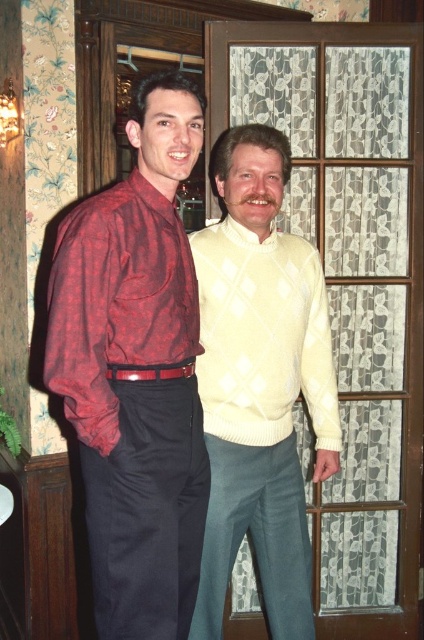
Question: Can you confirm if plaid shirt at left is thinner than matte red plaid shirt at left?

Choices:
 (A) no
 (B) yes

Answer: (A)

Question: Which of the following is the farthest from the observer?

Choices:
 (A) matte yellow sweater at center
 (B) plaid shirt at left

Answer: (A)

Question: Can you confirm if matte yellow sweater at center is smaller than matte red plaid shirt at left?

Choices:
 (A) yes
 (B) no

Answer: (B)

Question: Which of the following is the closest to the observer?

Choices:
 (A) cream knitted sweater at center
 (B) plaid shirt at left
 (C) matte red plaid shirt at left

Answer: (C)

Question: Which of the following is the farthest from the observer?

Choices:
 (A) plaid shirt at left
 (B) matte red plaid shirt at left
 (C) matte yellow sweater at center

Answer: (C)

Question: From the image, what is the correct spatial relationship of matte yellow sweater at center in relation to matte red plaid shirt at left?

Choices:
 (A) right
 (B) left

Answer: (A)